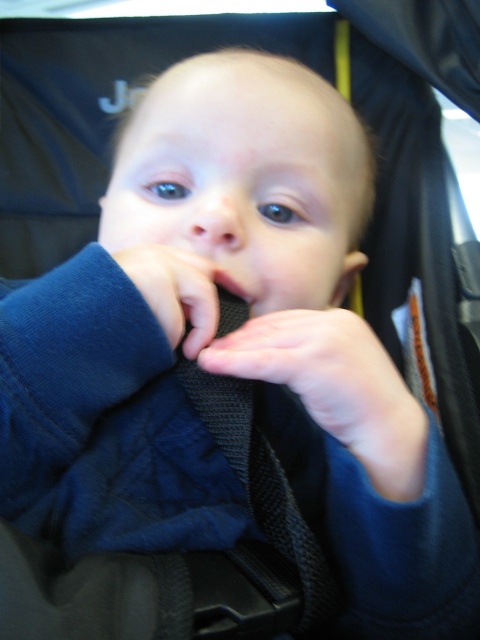
Does matte black strap at center have a lesser height compared to dark blue fabric at center?

No, matte black strap at center is not shorter than dark blue fabric at center.

Find the location of a particular element. matte black strap at center is located at coordinates (334, 385).

Can you confirm if dark blue fabric at center is shorter than matte black mouth at center?

Incorrect, dark blue fabric at center's height does not fall short of matte black mouth at center's.

Does dark blue fabric at center have a greater width compared to matte black mouth at center?

Correct, the width of dark blue fabric at center exceeds that of matte black mouth at center.

What do you see at coordinates (175, 291) in the screenshot? I see `dark blue fabric at center` at bounding box center [175, 291].

Identify the location of dark blue fabric at center. (175, 291).

Between matte black strap at center and matte black mouth at center, which one is positioned higher?

matte black mouth at center is above.

Can you confirm if matte black strap at center is smaller than matte black mouth at center?

No.

This screenshot has height=640, width=480. What do you see at coordinates (334, 385) in the screenshot?
I see `matte black strap at center` at bounding box center [334, 385].

Where is `matte black strap at center`? matte black strap at center is located at coordinates (334, 385).